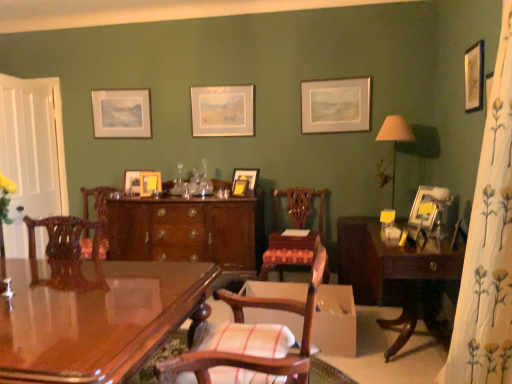
Question: Can you confirm if white wood screen door at left is bigger than white floral fabric curtain at right?

Choices:
 (A) no
 (B) yes

Answer: (A)

Question: Does white wood screen door at left come in front of white floral fabric curtain at right?

Choices:
 (A) no
 (B) yes

Answer: (A)

Question: Is the depth of white wood screen door at left greater than that of white floral fabric curtain at right?

Choices:
 (A) no
 (B) yes

Answer: (B)

Question: From a real-world perspective, does white wood screen door at left sit lower than white floral fabric curtain at right?

Choices:
 (A) no
 (B) yes

Answer: (A)

Question: Is white wood screen door at left aimed at white floral fabric curtain at right?

Choices:
 (A) yes
 (B) no

Answer: (B)

Question: Looking at their shapes, would you say wooden chair with striped cushion at center, which appears as the second chair when viewed from the back, is wider or thinner than matte silver picture frame at upper center, acting as the third picture frame starting from the right?

Choices:
 (A) thin
 (B) wide

Answer: (B)

Question: From the image's perspective, is wooden chair with striped cushion at center, which appears as the second chair when viewed from the back, located above or below matte silver picture frame at upper center, which is the fifth picture frame in front-to-back order?

Choices:
 (A) above
 (B) below

Answer: (B)

Question: Is point 253,357 positioned closer to the camera than point 302,117?

Choices:
 (A) closer
 (B) farther

Answer: (A)

Question: From their relative heights in the image, would you say wooden chair with striped cushion at center, the first chair when ordered from front to back, is taller or shorter than matte silver picture frame at upper center, acting as the third picture frame starting from the right?

Choices:
 (A) tall
 (B) short

Answer: (A)

Question: From a real-world perspective, is wooden chair at center, placed as the first chair when sorted from back to front, physically located above or below mahogany cabinet at center?

Choices:
 (A) above
 (B) below

Answer: (A)

Question: Would you say wooden chair at center, which is the second chair from front to back, is inside or outside mahogany cabinet at center?

Choices:
 (A) inside
 (B) outside

Answer: (B)

Question: Visually, is wooden chair at center, which is the second chair from front to back, positioned to the left or to the right of mahogany cabinet at center?

Choices:
 (A) right
 (B) left

Answer: (A)

Question: From their relative heights in the image, would you say wooden chair at center, which is the second chair from front to back, is taller or shorter than mahogany cabinet at center?

Choices:
 (A) short
 (B) tall

Answer: (A)

Question: In terms of height, does matte wooden picture frame at upper left, which is counted as the first picture frame, starting from the back, look taller or shorter compared to matte yellow picture frame at center, marked as the seventh picture frame in a back-to-front arrangement?

Choices:
 (A) tall
 (B) short

Answer: (A)

Question: From the image's perspective, is matte wooden picture frame at upper left, which appears as the first picture frame when viewed from the left, positioned above or below matte yellow picture frame at center, the third picture frame in the front-to-back sequence?

Choices:
 (A) above
 (B) below

Answer: (A)